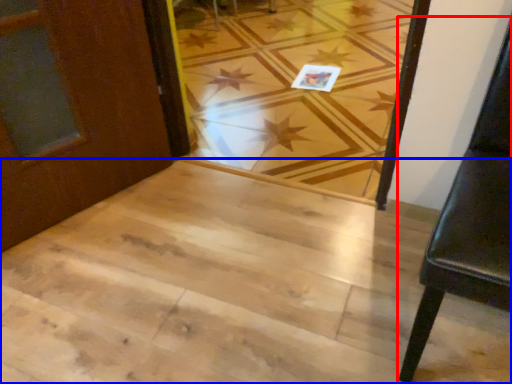
Question: Which object appears farthest to the camera in this image, furniture (highlighted by a red box) or stairwell (highlighted by a blue box)?

Choices:
 (A) furniture
 (B) stairwell

Answer: (B)